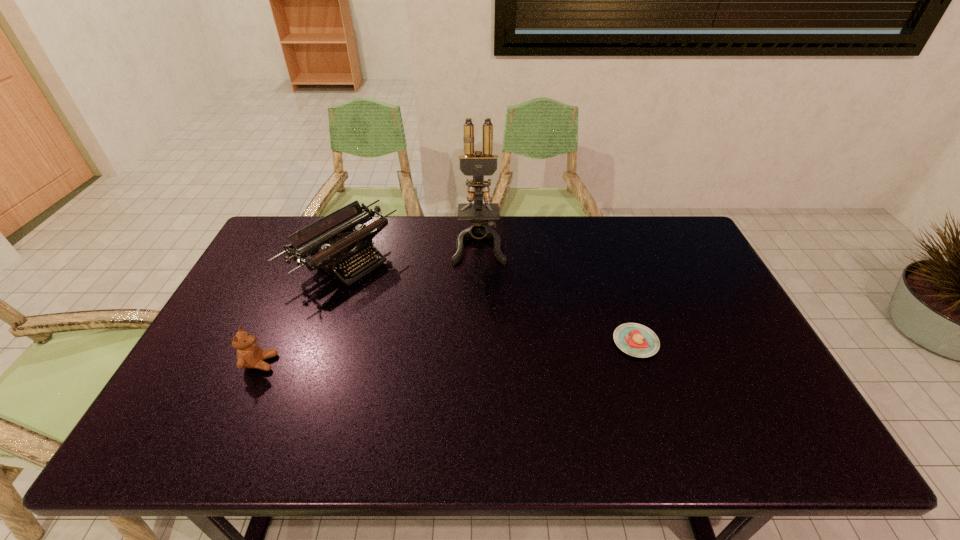
Locate an element on the screen. Image resolution: width=960 pixels, height=540 pixels. the third tallest object is located at coordinates (249, 354).

Image resolution: width=960 pixels, height=540 pixels. Identify the location of pastry. (637, 340).

Locate an element on the screen. The width and height of the screenshot is (960, 540). the shortest object is located at coordinates (637, 340).

Locate an element on the screen. microscope is located at coordinates (478, 165).

Image resolution: width=960 pixels, height=540 pixels. I want to click on the tallest object, so click(x=478, y=165).

Locate an element on the screen. Image resolution: width=960 pixels, height=540 pixels. the third shortest object is located at coordinates (341, 246).

Image resolution: width=960 pixels, height=540 pixels. In order to click on vacant space located on the face of the teddy bear in this screenshot , I will do `click(423, 363)`.

Identify the location of free space located 0.160m on the right of the rightmost object. (717, 342).

The width and height of the screenshot is (960, 540). Find the location of `blank space located 0.300m at the eyepieces of the third object from left to right`. blank space located 0.300m at the eyepieces of the third object from left to right is located at coordinates (481, 336).

Where is `free spot located at the eyepieces of the third object from left to right`? The height and width of the screenshot is (540, 960). free spot located at the eyepieces of the third object from left to right is located at coordinates (481, 366).